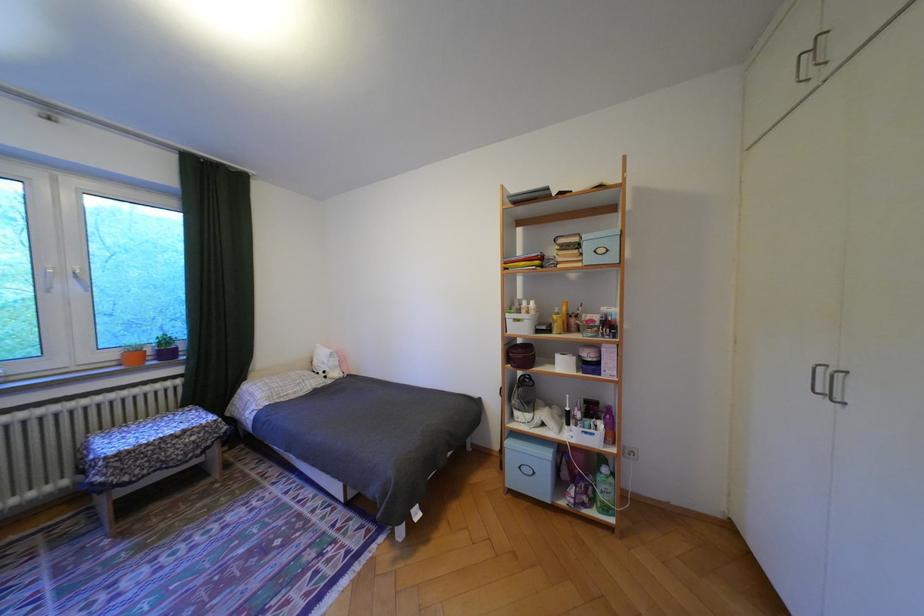
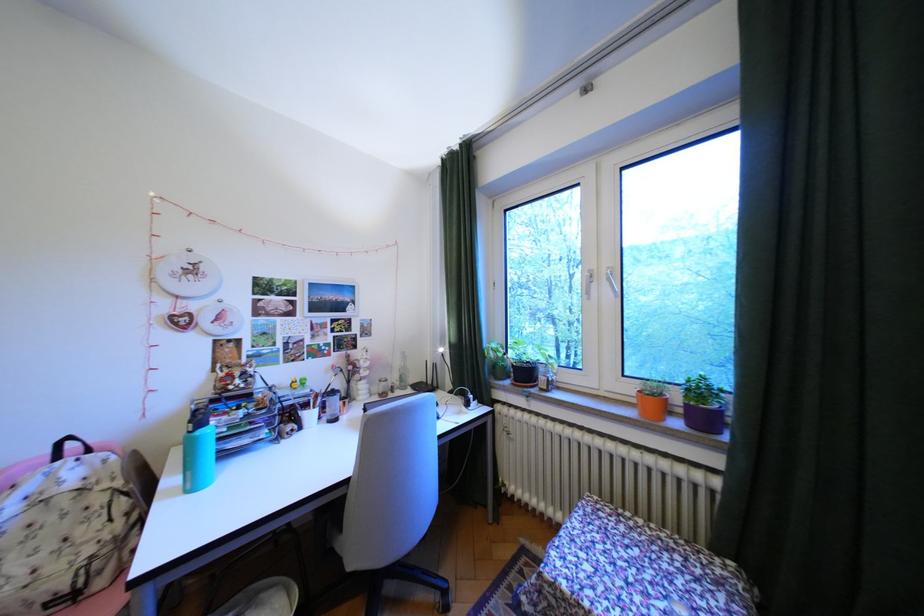
Find the pixel in the second image that matches pixel 128 455 in the first image.

(564, 585)